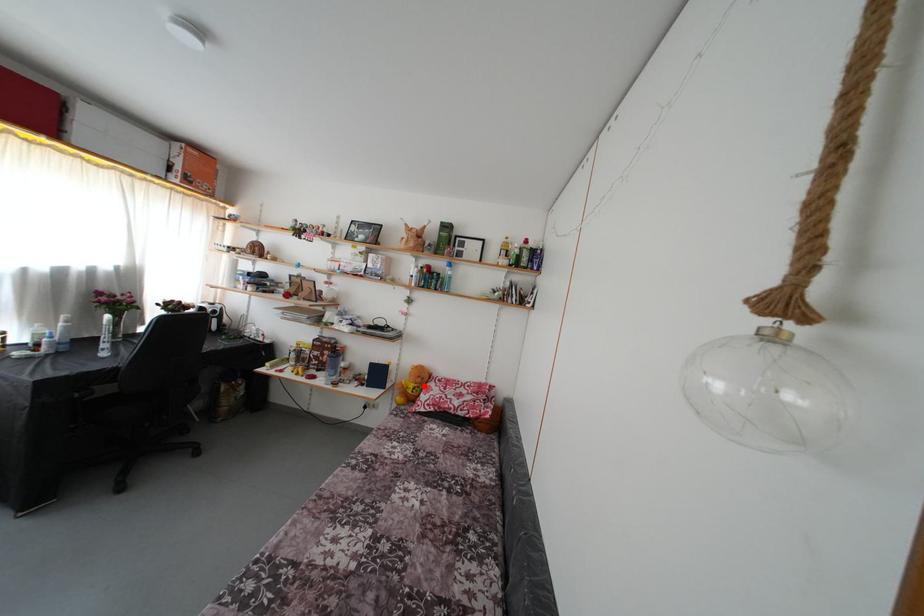
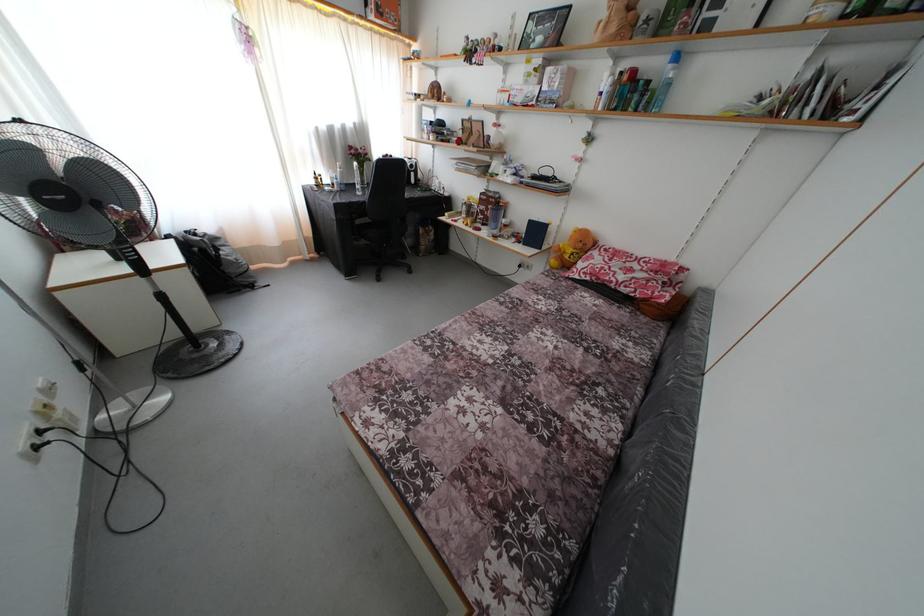
Question: I am providing you with two images of the same scene from different viewpoints. In image1, a red point is highlighted. Considering the same 3D point in image2, which of the following is correct?

Choices:
 (A) It is closer
 (B) It is farther

Answer: (A)